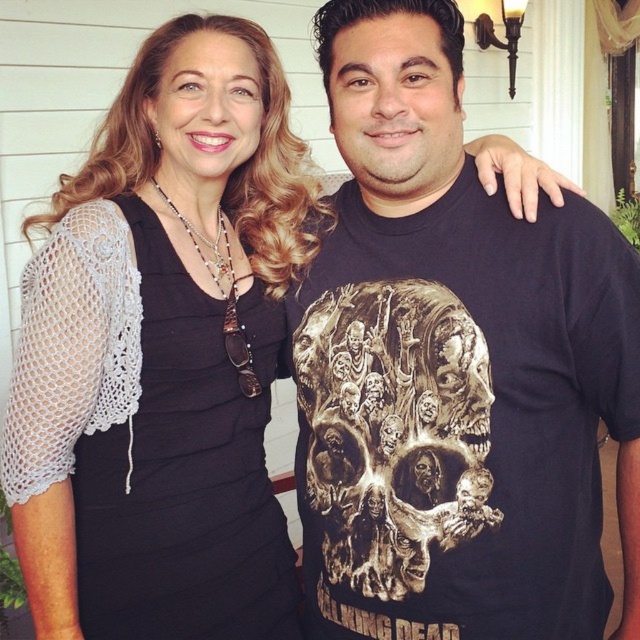
Consider the image. Is black crochet dress at left taller than gold metallic skull at center?

Correct, black crochet dress at left is much taller as gold metallic skull at center.

Does black crochet dress at left appear on the right side of gold metallic skull at center?

Incorrect, black crochet dress at left is not on the right side of gold metallic skull at center.

Which is behind, point (198, 321) or point (477, 524)?

The point (198, 321) is more distant.

Locate an element on the screen. black crochet dress at left is located at coordinates coord(186,472).

Does black matte t-shirt at center come in front of black crochet dress at left?

Yes, black matte t-shirt at center is closer to the viewer.

Is black matte t-shirt at center wider than black crochet dress at left?

Correct, the width of black matte t-shirt at center exceeds that of black crochet dress at left.

I want to click on black matte t-shirt at center, so click(486, 356).

What do you see at coordinates (486, 356) in the screenshot? The image size is (640, 640). I see `black matte t-shirt at center` at bounding box center [486, 356].

From the picture: Which is more to the right, black matte t-shirt at center or gold metallic skull at center?

From the viewer's perspective, black matte t-shirt at center appears more on the right side.

Where is `black matte t-shirt at center`? black matte t-shirt at center is located at coordinates (486, 356).